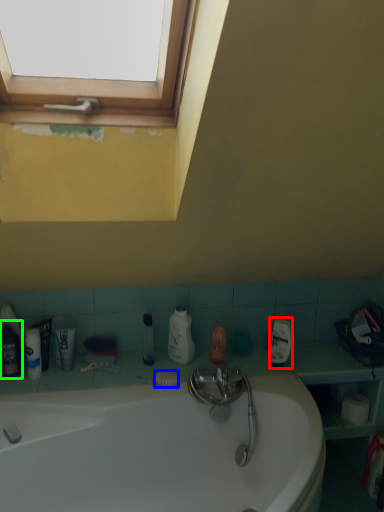
Question: Which object is the farthest from cleaning product (highlighted by a red box)? Choose among these: soap (highlighted by a blue box) or mouthwash (highlighted by a green box).

Choices:
 (A) soap
 (B) mouthwash

Answer: (B)